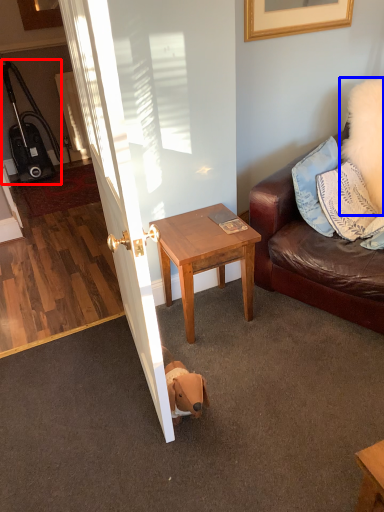
Question: Which object is further to the camera taking this photo, luggage (highlighted by a red box) or pillow (highlighted by a blue box)?

Choices:
 (A) luggage
 (B) pillow

Answer: (A)